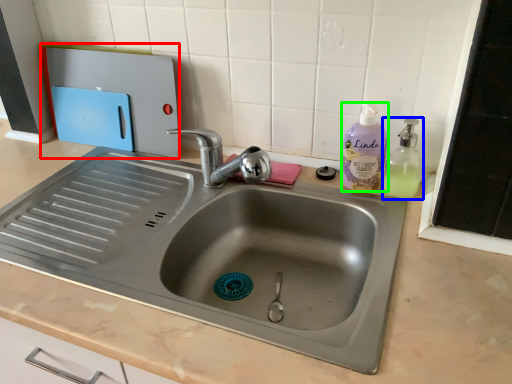
Question: Which is farther away from appliance (highlighted by a red box)? soap dispenser (highlighted by a blue box) or cleaning product (highlighted by a green box)?

Choices:
 (A) soap dispenser
 (B) cleaning product

Answer: (A)